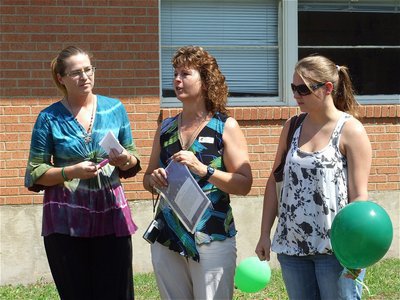
Where is `blinds`? blinds is located at coordinates (253, 74).